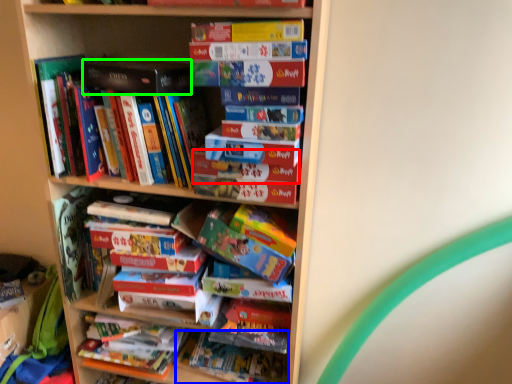
Question: Considering the real-world distances, which object is closest to paperback book (highlighted by a red box)? book (highlighted by a blue box) or paperback book (highlighted by a green box).

Choices:
 (A) book
 (B) paperback book

Answer: (B)